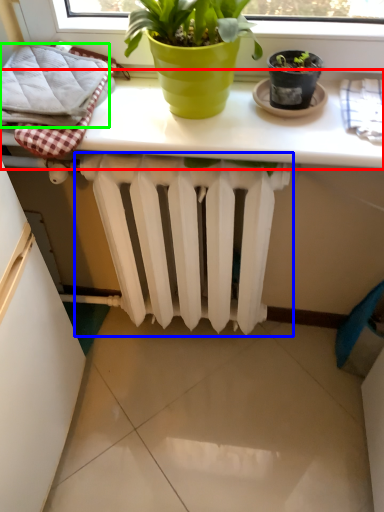
Question: Which object is positioned closest to table (highlighted by a red box)? Select from radiator (highlighted by a blue box) and bath towel (highlighted by a green box).

Choices:
 (A) radiator
 (B) bath towel

Answer: (B)